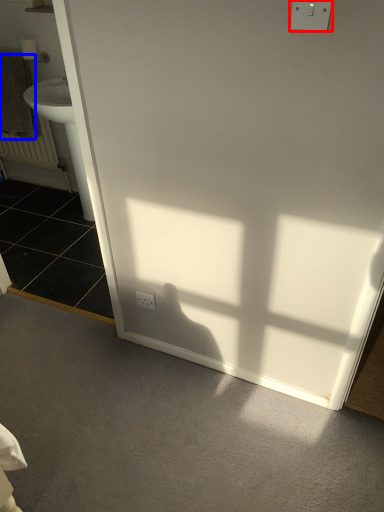
Question: Which of the following is the farthest to the observer, electric outlet (highlighted by a red box) or towel/napkin (highlighted by a blue box)?

Choices:
 (A) electric outlet
 (B) towel/napkin

Answer: (B)